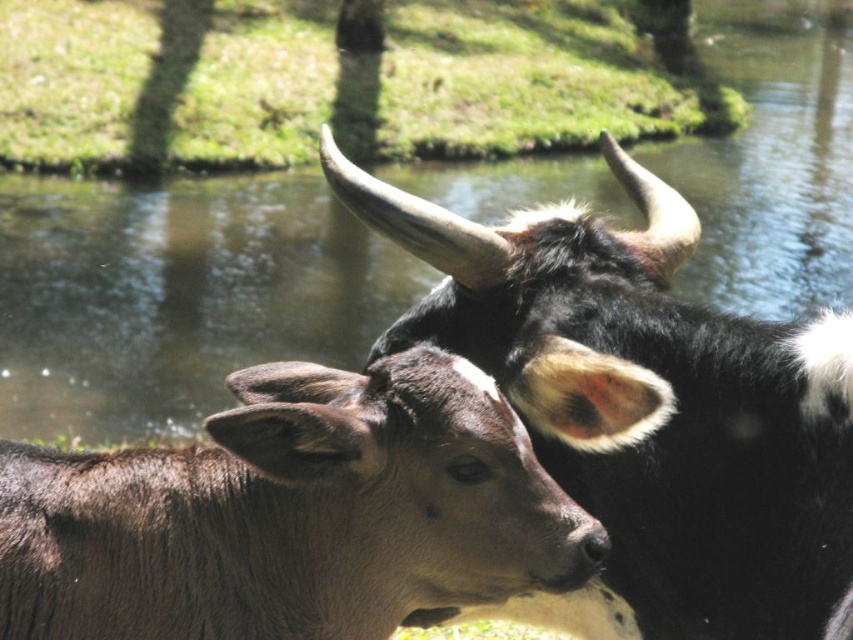
Question: Is black glossy horned buffalo at upper center bigger than green grass at upper center?

Choices:
 (A) no
 (B) yes

Answer: (A)

Question: Which point is farther to the camera?

Choices:
 (A) black glossy horned buffalo at upper center
 (B) brown furry buffalo at center
 (C) green grass at upper center

Answer: (C)

Question: Which object appears farthest from the camera in this image?

Choices:
 (A) black glossy horned buffalo at upper center
 (B) green grass at upper center
 (C) brown furry buffalo at center

Answer: (B)

Question: Is brown furry buffalo at center below green grass at upper center?

Choices:
 (A) no
 (B) yes

Answer: (B)

Question: Can you confirm if brown furry buffalo at center is positioned to the left of green grass at upper center?

Choices:
 (A) no
 (B) yes

Answer: (A)

Question: Estimate the real-world distances between objects in this image. Which object is farther from the black glossy horned buffalo at upper center?

Choices:
 (A) brown furry buffalo at center
 (B) green grass at upper center

Answer: (B)